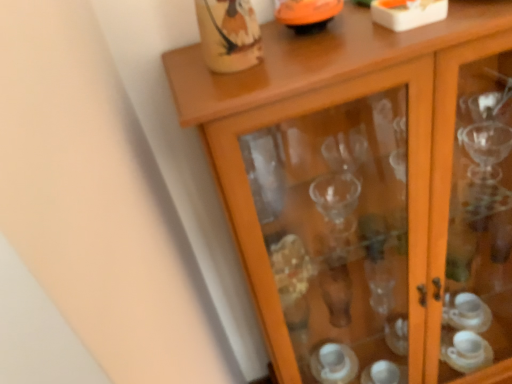
The width and height of the screenshot is (512, 384). In order to click on free spot in front of orange glossy bowl at upper center in this screenshot , I will do `click(319, 49)`.